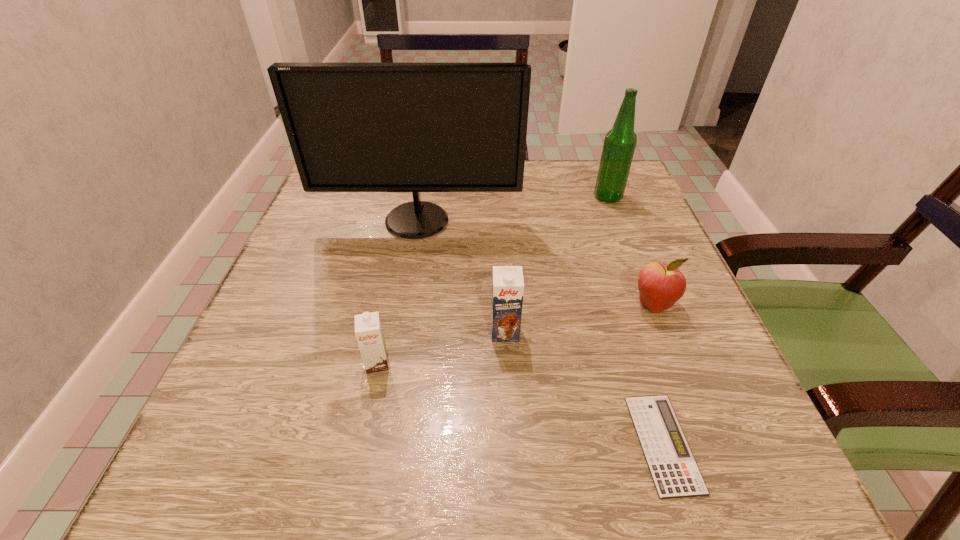
I want to click on free space at the near left corner of the desktop, so click(x=188, y=485).

Identify the location of vacant area at the far right corner of the desktop. The image size is (960, 540). (579, 200).

The width and height of the screenshot is (960, 540). Identify the location of vacant space at the near right corner. (718, 468).

The height and width of the screenshot is (540, 960). I want to click on vacant area that lies between the apple and the shortest object, so click(658, 374).

Find the location of a particular element. The image size is (960, 540). free spot between the farther chocolate milk and the shorter chocolate milk is located at coordinates (441, 347).

I want to click on unoccupied position between the computer monitor and the third nearest object, so click(x=461, y=276).

Where is `blank region between the tallest object and the apple`? The image size is (960, 540). blank region between the tallest object and the apple is located at coordinates (535, 262).

At what (x,y) coordinates should I click in order to perform the action: click on free point between the shortest object and the fourth nearest object. Please return your answer as a coordinate pair (x, y). Image resolution: width=960 pixels, height=540 pixels. Looking at the image, I should click on (658, 374).

Find the location of a particular element. free space between the nearer chocolate milk and the tallest object is located at coordinates (397, 292).

I want to click on free space between the right chocolate milk and the left chocolate milk, so click(x=441, y=347).